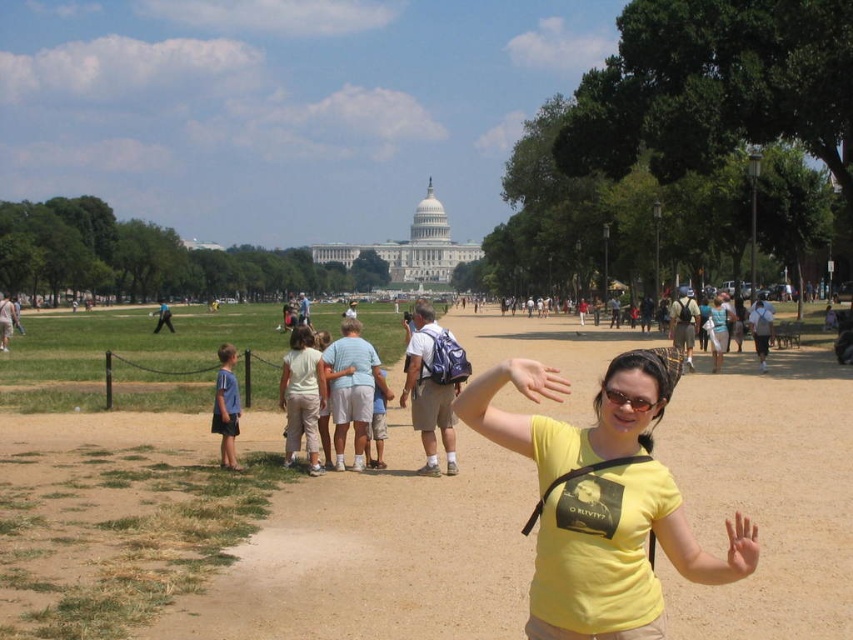
Who is higher up, matte yellow t-shirt at center or matte black sunglasses at center?

matte yellow t-shirt at center is above.

Is matte yellow t-shirt at center taller than matte black sunglasses at center?

Yes, matte yellow t-shirt at center is taller than matte black sunglasses at center.

Is point (520, 387) positioned before point (654, 408)?

That is True.

Find the location of a particular element. matte yellow t-shirt at center is located at coordinates (535, 380).

Does yellow t-shirt at center lie in front of matte yellow t-shirt at center?

Yes, yellow t-shirt at center is closer to the viewer.

Who is more distant from viewer, [653,518] or [538,384]?

Positioned behind is point [538,384].

In order to click on yellow t-shirt at center in this screenshot , I will do `click(604, 508)`.

Does yellow t-shirt at center have a greater height compared to matte black sunglasses at center?

Correct, yellow t-shirt at center is much taller as matte black sunglasses at center.

Can you confirm if yellow t-shirt at center is positioned to the right of matte black sunglasses at center?

Yes, yellow t-shirt at center is to the right of matte black sunglasses at center.

This screenshot has width=853, height=640. Describe the element at coordinates (604, 508) in the screenshot. I see `yellow t-shirt at center` at that location.

At what (x,y) coordinates should I click in order to perform the action: click on yellow t-shirt at center. Please return your answer as a coordinate pair (x, y). The width and height of the screenshot is (853, 640). Looking at the image, I should click on (604, 508).